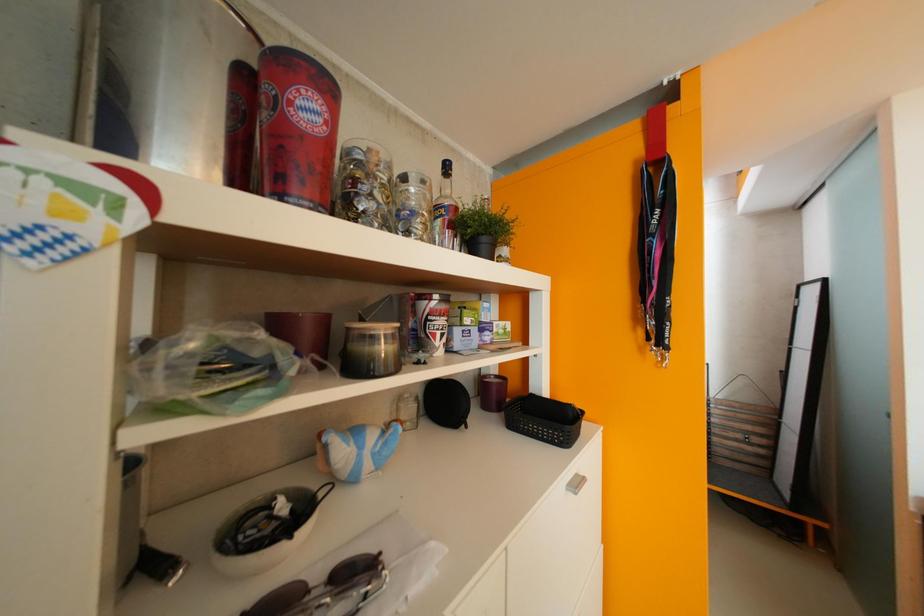
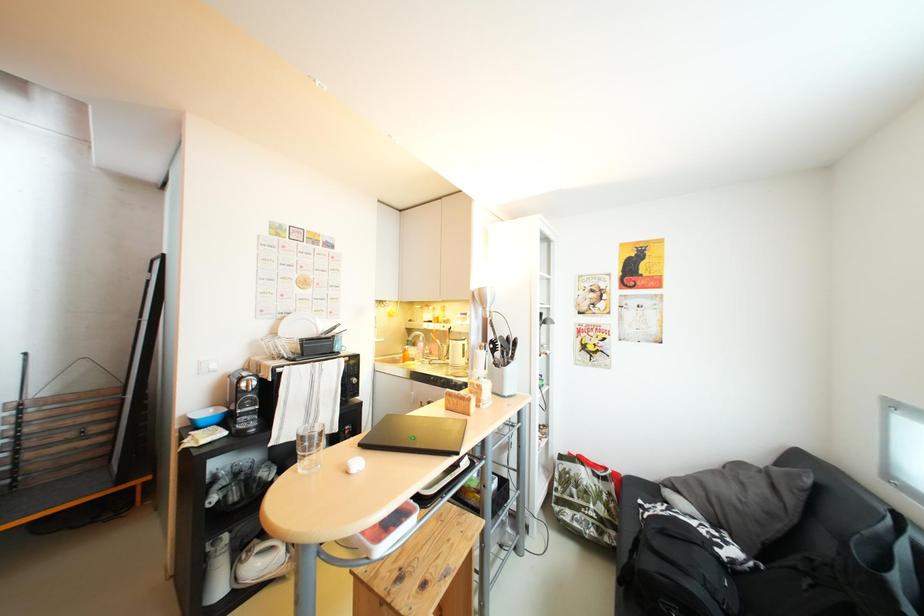
Question: The camera is either moving clockwise (left) or counter-clockwise (right) around the object. The first image is from the beginning of the video and the second image is from the end. Is the camera moving left or right when shooting the video?

Choices:
 (A) Left
 (B) Right

Answer: (A)